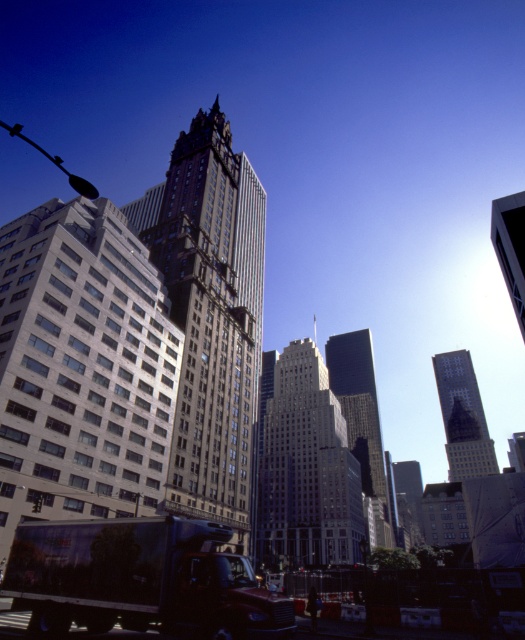
Is metallic silver truck at lower left to the right of smooth gray skyscraper at center from the viewer's perspective?

In fact, metallic silver truck at lower left is to the left of smooth gray skyscraper at center.

Describe the element at coordinates (140, 579) in the screenshot. This screenshot has width=525, height=640. I see `metallic silver truck at lower left` at that location.

At what (x,y) coordinates should I click in order to perform the action: click on metallic silver truck at lower left. Please return your answer as a coordinate pair (x, y). This screenshot has width=525, height=640. Looking at the image, I should click on (140, 579).

Can you confirm if glassy reflective skyscraper at center is positioned to the left of reflective glass skyscraper at center?

Indeed, glassy reflective skyscraper at center is positioned on the left side of reflective glass skyscraper at center.

Does point (375, 397) lie behind point (475, 420)?

Yes.

You are a GUI agent. You are given a task and a screenshot of the screen. Output one action in this format:
    pyautogui.click(x=<x>, y=<y>)
    Task: Click on the glassy reflective skyscraper at center
    
    Given the screenshot: What is the action you would take?
    362,428

This screenshot has height=640, width=525. Find the location of `smooth gray skyscraper at center`. smooth gray skyscraper at center is located at coordinates click(307, 468).

Can you confirm if smooth gray skyscraper at center is positioned below reflective glass skyscraper at center?

No.

Find the location of `smooth gray skyscraper at center`. smooth gray skyscraper at center is located at coordinates [x=307, y=468].